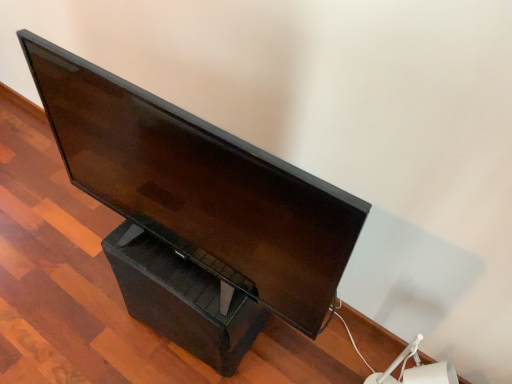
You are a GUI agent. You are given a task and a screenshot of the screen. Output one action in this format:
    pyautogui.click(x=<x>, y=<y>)
    Task: Click on the vacant point to the left of black plastic drawer at lower center
    Image resolution: width=512 pixels, height=384 pixels.
    Given the screenshot: What is the action you would take?
    pyautogui.click(x=91, y=317)